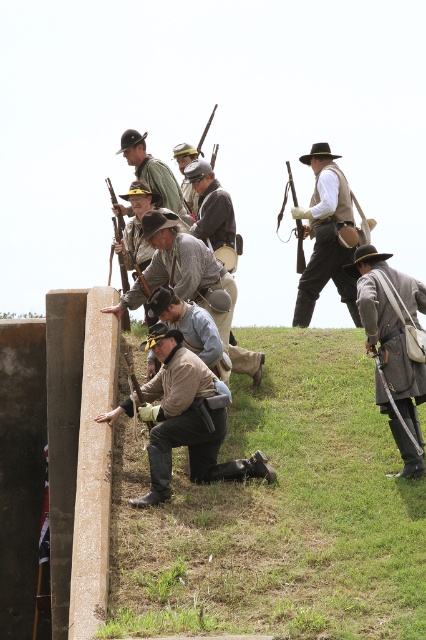
You are a photographer aiming to capture a portrait of the soldiers in the scene. You need to focus on the gray wool coat at lower right and the brown leather hat at center. Which object should you adjust your camera to prioritize if you want to focus on the one closer to the right side of the frame?

The gray wool coat at lower right should be prioritized as it is positioned to the right of the brown leather hat at center, making it closer to the right side of the frame.